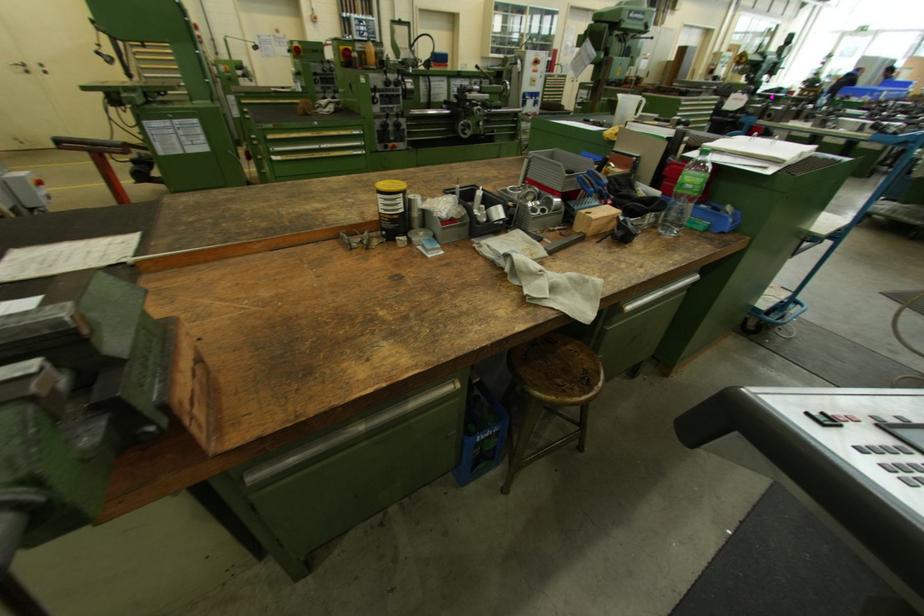
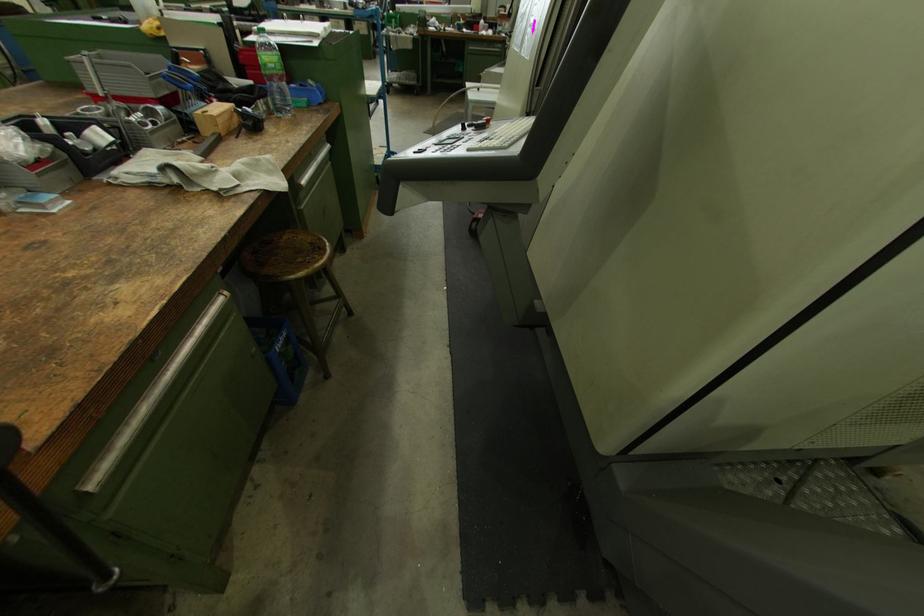
Find the pixel in the second image that matches [581,209] in the first image.

(192, 113)